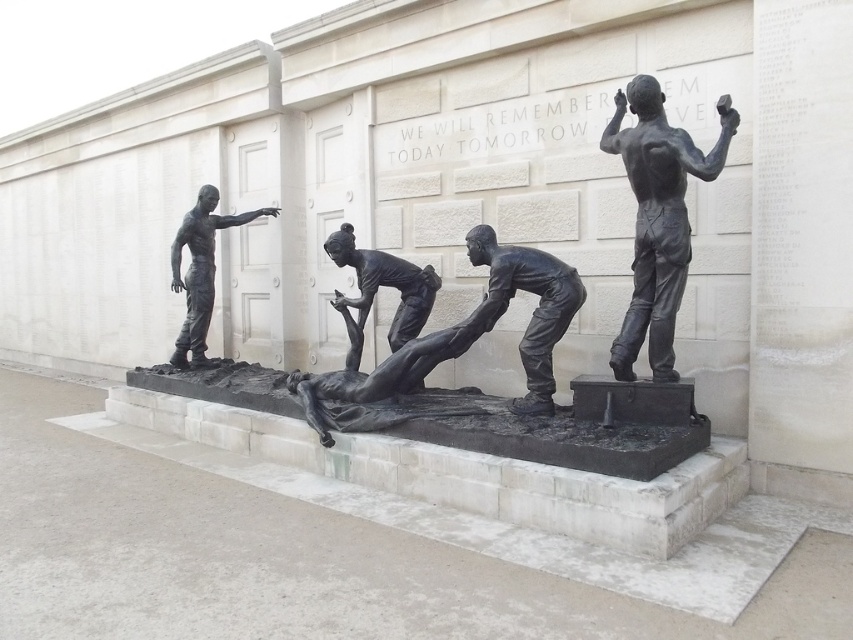
Does bronze statue at upper right have a larger size compared to bronze figure at center?

Yes, bronze statue at upper right is bigger than bronze figure at center.

Which is behind, point (636, 344) or point (485, 241)?

The point (485, 241) is behind.

What are the coordinates of `bronze statue at upper right` in the screenshot? It's located at (657, 218).

Is bronze statue at upper right above bronze statue of person at center?

Yes, bronze statue at upper right is above bronze statue of person at center.

Who is taller, bronze statue at upper right or bronze statue of person at center?

With more height is bronze statue at upper right.

Does point (641, 209) come behind point (334, 241)?

No, it is not.

Locate an element on the screen. Image resolution: width=853 pixels, height=640 pixels. bronze statue at upper right is located at coordinates (657, 218).

Who is shorter, bronze figure at center or bronze statue at left?

bronze figure at center is shorter.

Does bronze figure at center have a greater width compared to bronze statue at left?

No.

The image size is (853, 640). What do you see at coordinates (532, 310) in the screenshot? I see `bronze figure at center` at bounding box center [532, 310].

Locate an element on the screen. The image size is (853, 640). bronze figure at center is located at coordinates (532, 310).